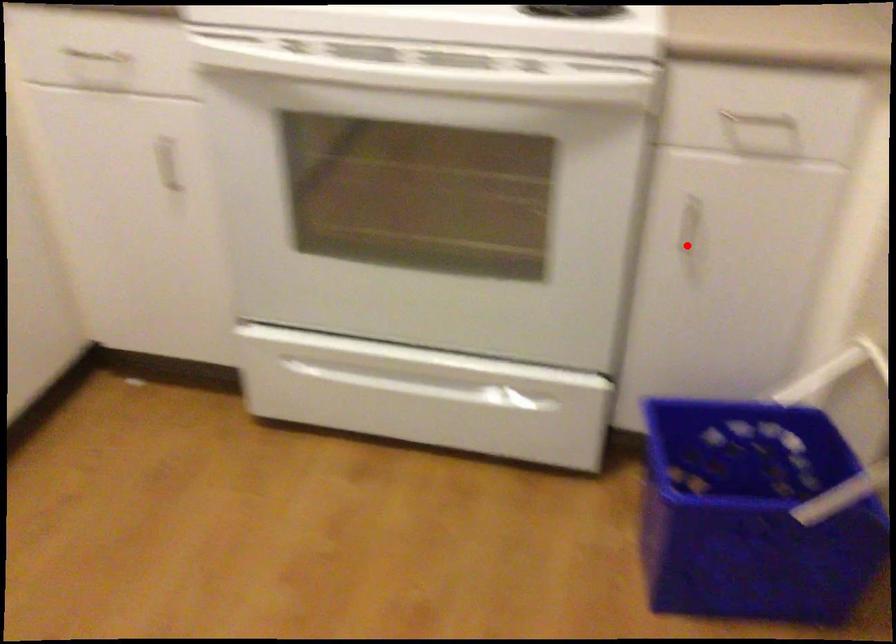
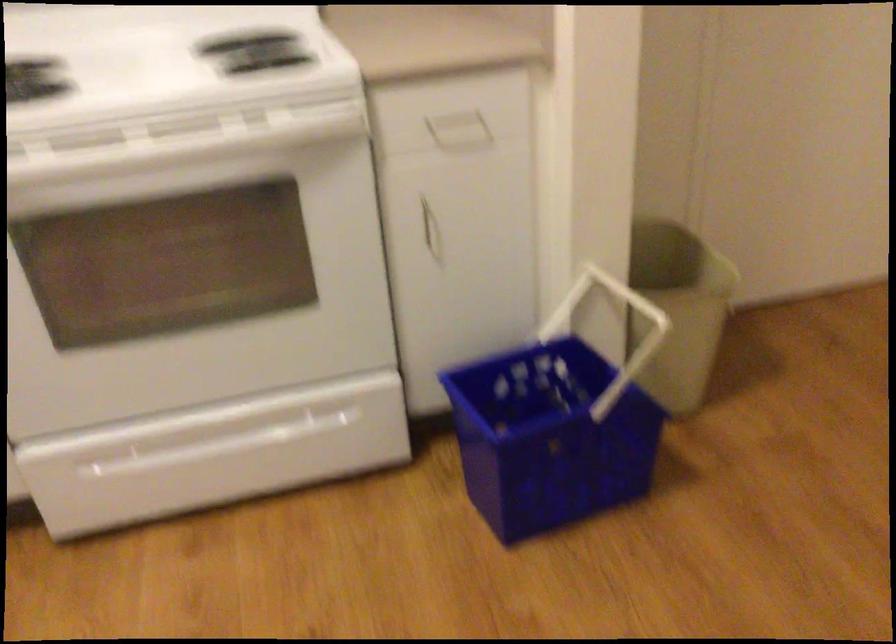
In the second image, find the point that corresponds to the highlighted location in the first image.

(431, 234)